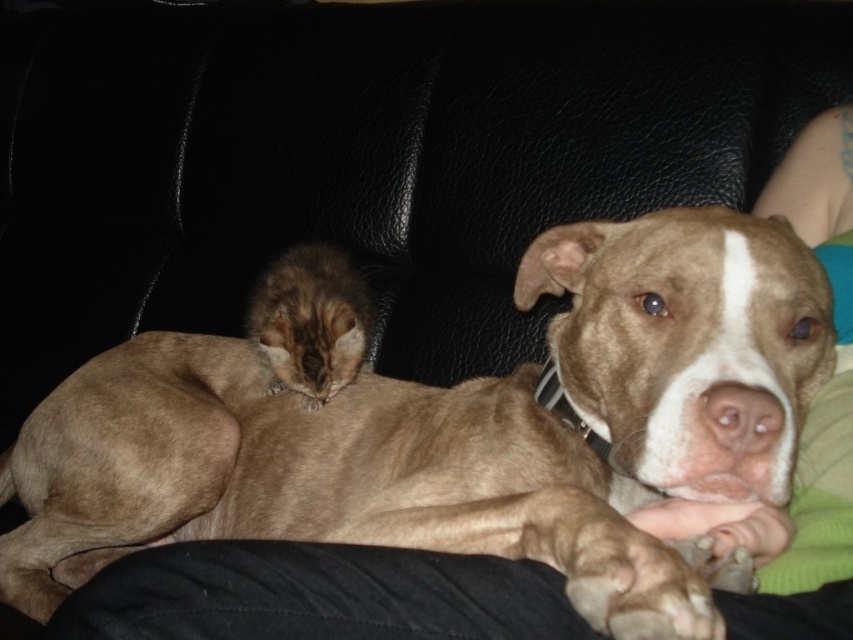
Question: Which point is closer to the camera?

Choices:
 (A) (267, 300)
 (B) (747, 573)

Answer: (B)

Question: Which of the following is the closest to the observer?

Choices:
 (A) brown fur dog at center
 (B) fuzzy brown cat at center

Answer: (A)

Question: Observing the image, what is the correct spatial positioning of brown fur dog at center in reference to fuzzy brown cat at center?

Choices:
 (A) left
 (B) right

Answer: (B)

Question: Which point is closer to the camera?

Choices:
 (A) (355, 321)
 (B) (401, 499)

Answer: (B)

Question: Does brown fur dog at center appear on the right side of fuzzy brown cat at center?

Choices:
 (A) no
 (B) yes

Answer: (B)

Question: Does brown fur dog at center have a greater width compared to fuzzy brown cat at center?

Choices:
 (A) no
 (B) yes

Answer: (B)